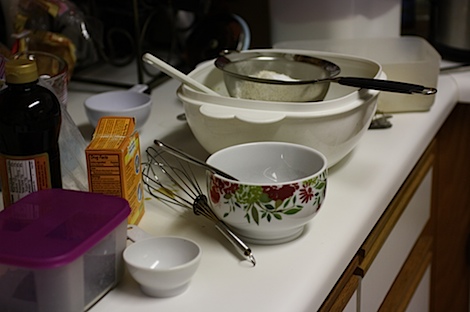
Locate an element on the screen. The width and height of the screenshot is (470, 312). plastic container is located at coordinates (410, 51).